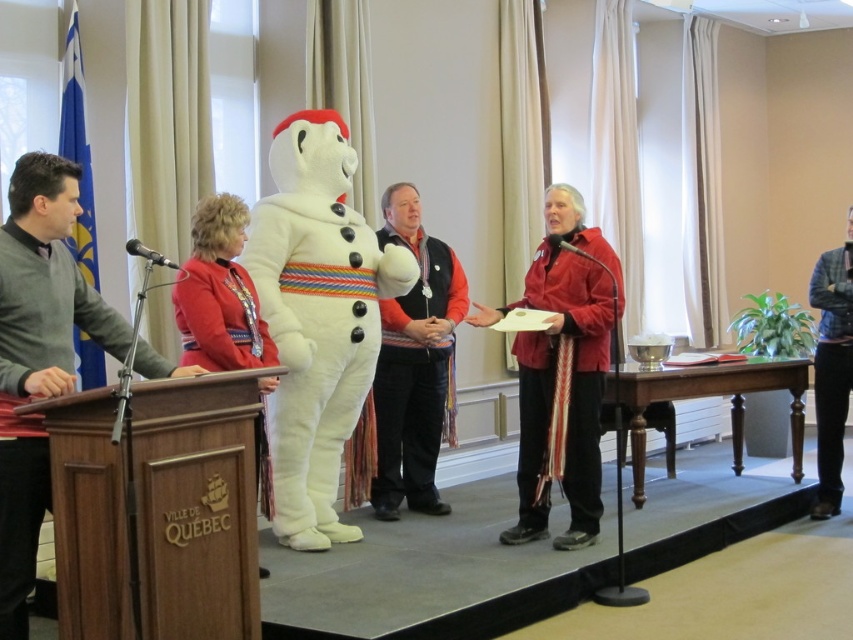
Does white plush snowman at center appear on the right side of wooden podium at center?

In fact, white plush snowman at center is to the left of wooden podium at center.

Is point (341, 193) positioned after point (730, 381)?

No, it is in front of (730, 381).

The width and height of the screenshot is (853, 640). In order to click on white plush snowman at center in this screenshot , I will do `click(317, 317)`.

You are a GUI agent. You are given a task and a screenshot of the screen. Output one action in this format:
    pyautogui.click(x=<x>, y=<y>)
    Task: Click on the white plush snowman at center
    The height and width of the screenshot is (640, 853).
    Given the screenshot: What is the action you would take?
    pyautogui.click(x=317, y=317)

Who is more distant from viewer, (79, 588) or (521, 509)?

The point (521, 509) is behind.

Which is behind, point (77, 564) or point (535, 358)?

Point (535, 358)

You are a GUI agent. You are given a task and a screenshot of the screen. Output one action in this format:
    pyautogui.click(x=<x>, y=<y>)
    Task: Click on the brown wood podium at left
    This screenshot has width=853, height=640.
    Given the screenshot: What is the action you would take?
    pyautogui.click(x=157, y=509)

In the scene shown: Does brown wood podium at left have a greater width compared to blue corduroy jacket at right?

Indeed, brown wood podium at left has a greater width compared to blue corduroy jacket at right.

Based on the photo, is brown wood podium at left in front of blue corduroy jacket at right?

Yes, brown wood podium at left is in front of blue corduroy jacket at right.

Between point (154, 621) and point (824, 358), which one is positioned behind?

Point (824, 358)

This screenshot has height=640, width=853. I want to click on brown wood podium at left, so click(x=157, y=509).